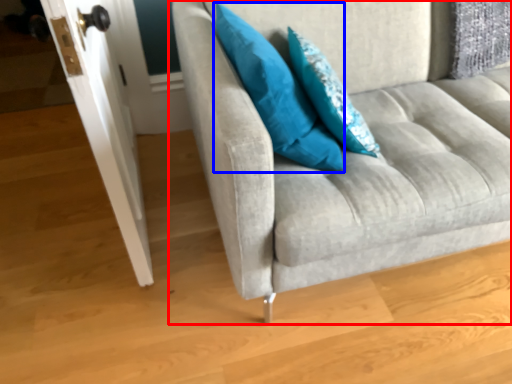
Question: Which point is further to the camera, studio couch (highlighted by a red box) or pillow (highlighted by a blue box)?

Choices:
 (A) studio couch
 (B) pillow

Answer: (B)